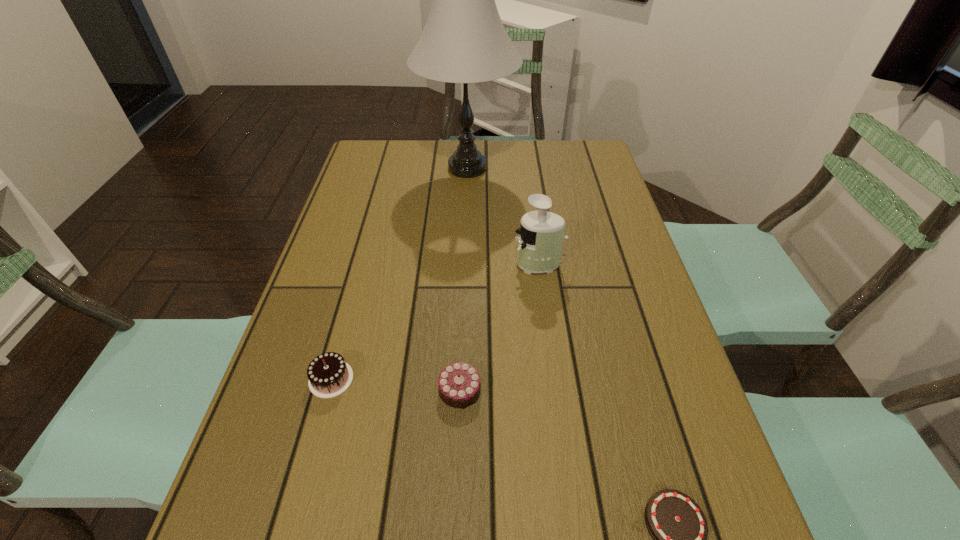
Identify the location of vacant area between the lamp and the juicer. (503, 216).

This screenshot has height=540, width=960. I want to click on free space between the leftmost object and the juicer, so tap(435, 321).

Where is `free space between the farthest object and the second shortest object`? This screenshot has height=540, width=960. free space between the farthest object and the second shortest object is located at coordinates (464, 279).

You are a GUI agent. You are given a task and a screenshot of the screen. Output one action in this format:
    pyautogui.click(x=<x>, y=<y>)
    Task: Click on the free spot between the tallest object and the second chocolate cake from right to left
    Image resolution: width=960 pixels, height=540 pixels.
    Given the screenshot: What is the action you would take?
    pyautogui.click(x=464, y=279)

Locate an element on the screen. empty location between the fourth nearest object and the lamp is located at coordinates (503, 216).

Identify the location of vacant area that lies between the tallest object and the fourth tallest object. (464, 279).

Find the location of `object that is the third closest to the tallest object`. object that is the third closest to the tallest object is located at coordinates (459, 384).

Where is `object that is the third closest to the nearest object`? The width and height of the screenshot is (960, 540). object that is the third closest to the nearest object is located at coordinates (329, 375).

Where is `chocolate cake object that ranks as the second closest to the second chocolate cake from left to right`? This screenshot has width=960, height=540. chocolate cake object that ranks as the second closest to the second chocolate cake from left to right is located at coordinates (679, 529).

This screenshot has width=960, height=540. I want to click on the third closest chocolate cake to the second tallest object, so click(x=679, y=529).